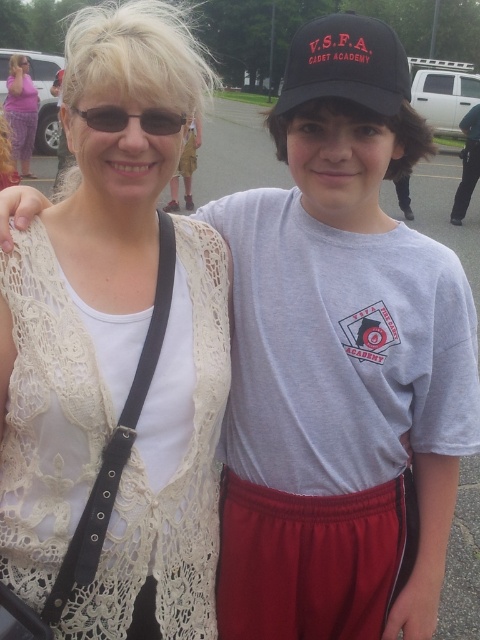
Question: Does black matte baseball cap at upper center have a larger size compared to matte black sunglasses at upper left?

Choices:
 (A) no
 (B) yes

Answer: (B)

Question: Can you confirm if white lace vest at upper left is positioned above black matte baseball cap at upper center?

Choices:
 (A) no
 (B) yes

Answer: (A)

Question: Which point is closer to the camera?

Choices:
 (A) (343, 17)
 (B) (20, 61)
 (C) (84, 115)
 (D) (81, 228)

Answer: (C)

Question: Based on their relative distances, which object is farther from the black matte baseball cap at upper center?

Choices:
 (A) matte purple dress at upper left
 (B) matte black sunglasses at upper left
 (C) white lace vest at upper left

Answer: (A)

Question: Which point appears farthest from the camera in this image?

Choices:
 (A) (386, 49)
 (B) (17, 74)
 (C) (139, 115)
 (D) (119, 326)

Answer: (B)

Question: Does white lace vest at upper left have a greater width compared to matte purple dress at upper left?

Choices:
 (A) no
 (B) yes

Answer: (A)